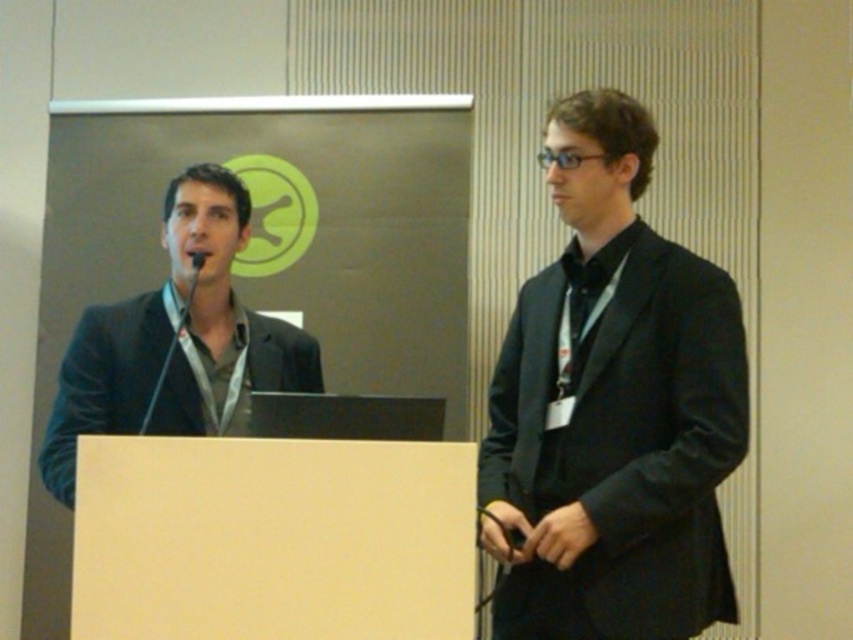
Question: Is black matte suit at center behind matte black suit at left?

Choices:
 (A) yes
 (B) no

Answer: (B)

Question: Does black matte suit at center lie in front of matte black suit at left?

Choices:
 (A) no
 (B) yes

Answer: (B)

Question: Which point is closer to the camera taking this photo?

Choices:
 (A) [668, 502]
 (B) [190, 298]

Answer: (A)

Question: Which object is farther from the camera taking this photo?

Choices:
 (A) matte black suit at left
 (B) black matte suit at center

Answer: (A)

Question: Is black matte suit at center wider than matte black suit at left?

Choices:
 (A) yes
 (B) no

Answer: (B)